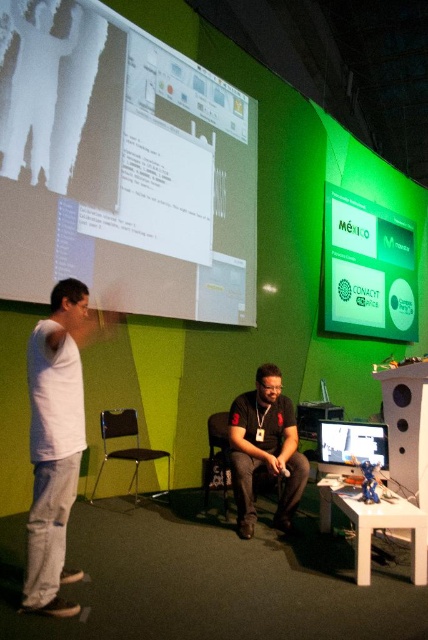
Is point (82, 106) closer to viewer compared to point (136, 481)?

Yes, it is.

Between white matte projection screen at upper left and brown leather chair at lower left, which one is positioned higher?

white matte projection screen at upper left

Locate an element on the screen. The height and width of the screenshot is (640, 428). white matte projection screen at upper left is located at coordinates (121, 164).

Where is `white matte projection screen at upper left`? The height and width of the screenshot is (640, 428). white matte projection screen at upper left is located at coordinates (121, 164).

Does white matte projection screen at upper left have a greater width compared to black matte shirt at center?

Yes.

Describe the element at coordinates (121, 164) in the screenshot. The width and height of the screenshot is (428, 640). I see `white matte projection screen at upper left` at that location.

The image size is (428, 640). Identify the location of white matte projection screen at upper left. (121, 164).

Is point (372, 330) in front of point (228, 509)?

No, it is not.

Which is in front, point (377, 275) or point (226, 465)?

Point (226, 465)

Locate an element on the screen. This screenshot has width=428, height=640. green matte projection screen at upper right is located at coordinates (366, 269).